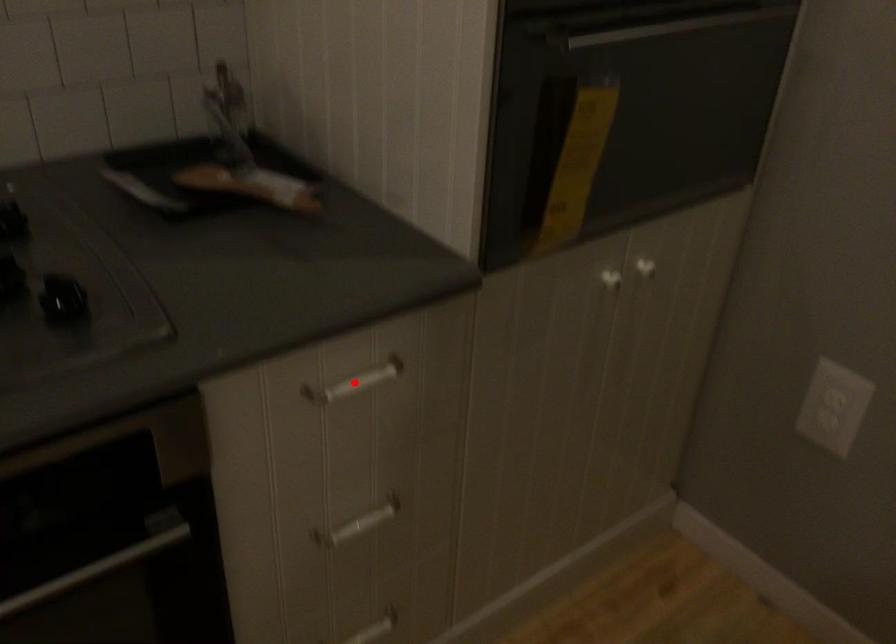
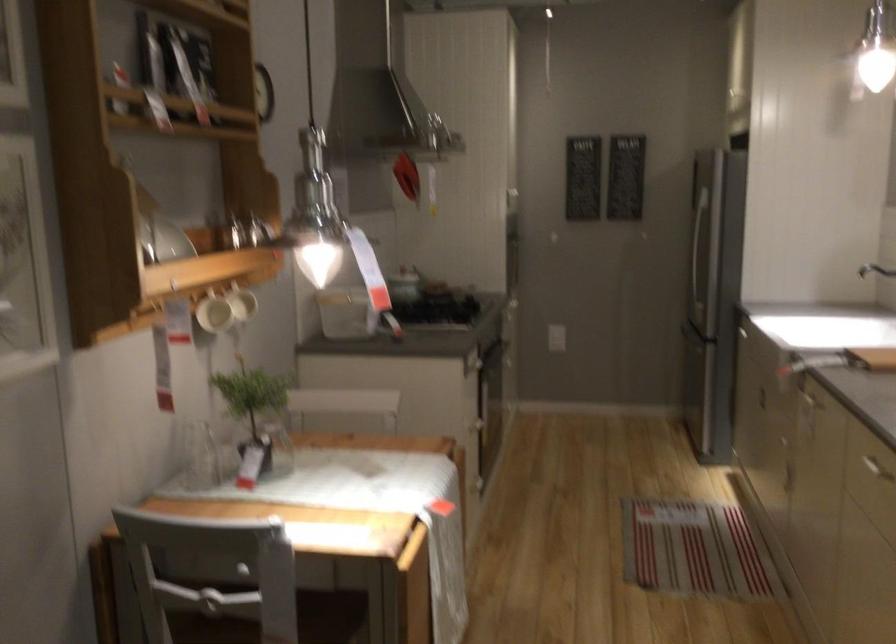
Question: I am providing you with two images of the same scene from different viewpoints. A red point is marked on the first image. Can you still see the location of the red point in image 2?

Choices:
 (A) Yes
 (B) No

Answer: (B)